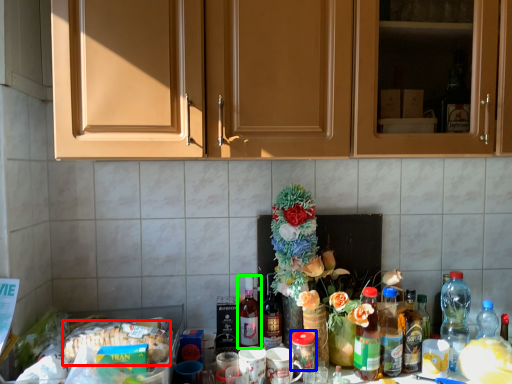
Question: Based on their relative distances, which object is nearer to food (highlighted by a red box)? Choose from beverage (highlighted by a blue box) and bottle (highlighted by a green box).

Choices:
 (A) beverage
 (B) bottle

Answer: (B)